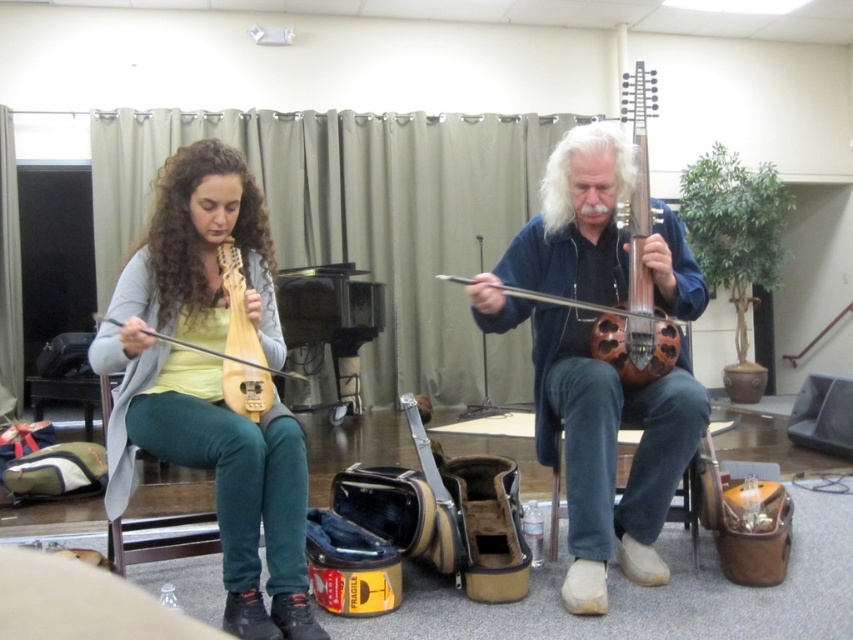
Question: Where is matte wood violin at left located in relation to light brown wood guitar at center-left in the image?

Choices:
 (A) right
 (B) left

Answer: (B)

Question: Which of the following is the farthest from the observer?

Choices:
 (A) (642, 246)
 (B) (236, 337)
 (C) (285, 433)

Answer: (A)

Question: Which of these objects is positioned farthest from the matte yellow wood lute at left?

Choices:
 (A) matte wood violin at left
 (B) wooden violin at center

Answer: (B)

Question: Does matte yellow wood lute at left lie in front of light brown wood guitar at center-left?

Choices:
 (A) no
 (B) yes

Answer: (B)

Question: Is matte yellow wood lute at left further to the viewer compared to light brown wood guitar at center-left?

Choices:
 (A) no
 (B) yes

Answer: (A)

Question: Which point appears farthest from the camera in this image?

Choices:
 (A) click(x=630, y=282)
 (B) click(x=229, y=344)
 (C) click(x=125, y=444)
 (D) click(x=236, y=339)

Answer: (A)